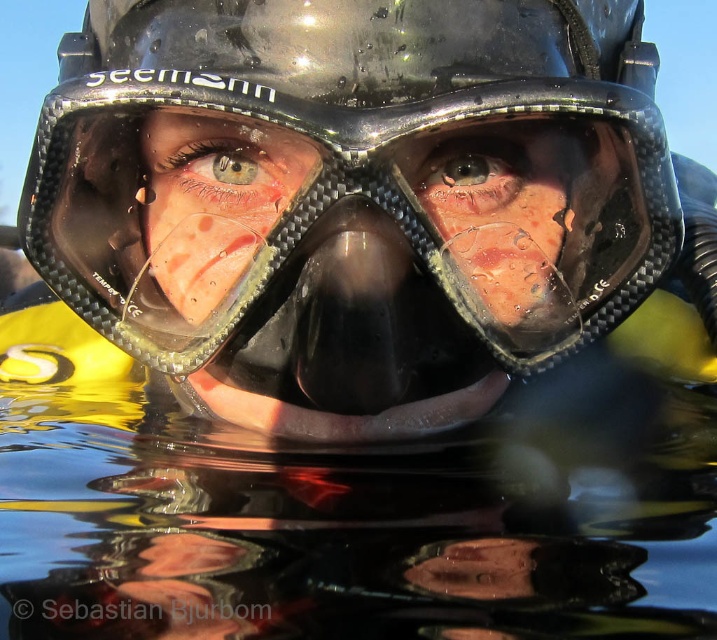
Question: Estimate the real-world distances between objects in this image. Which object is farther from the matte rubber face at center?

Choices:
 (A) clear glass eye at center
 (B) blue glossy eye at center
 (C) black matte helmet at center

Answer: (A)

Question: Is black matte helmet at center positioned in front of matte black scuba mask at center?

Choices:
 (A) no
 (B) yes

Answer: (B)

Question: From the image, what is the correct spatial relationship of black matte helmet at center in relation to matte black scuba mask at center?

Choices:
 (A) right
 (B) left

Answer: (B)

Question: Which object appears farthest from the camera in this image?

Choices:
 (A) matte rubber face at center
 (B) matte black scuba mask at center

Answer: (B)

Question: Based on their relative distances, which object is farther from the clear glass eye at center?

Choices:
 (A) matte rubber face at center
 (B) black matte helmet at center
 (C) blue glossy eye at center

Answer: (A)

Question: Can you confirm if black matte helmet at center is bigger than blue glossy eye at center?

Choices:
 (A) no
 (B) yes

Answer: (B)